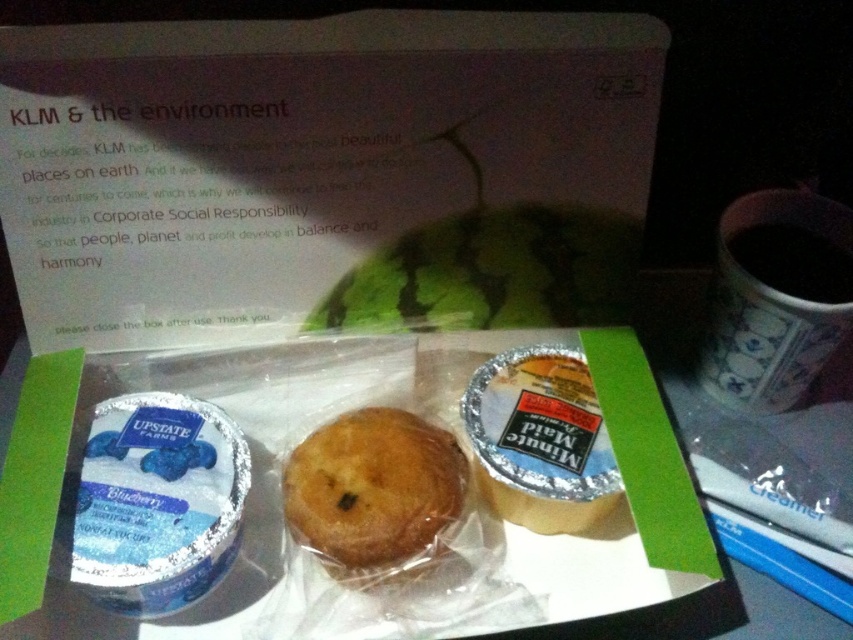
Based on the photo, you are a passenger on a KLM flight and want to reach the point at coordinates point (825, 323) on the meal tray. If you can extend your hand up to 1 meter, can you reach it?

The point at coordinates point (825, 323) is 1.01 meters away from the camera, so you cannot reach it with a hand extension of up to 1 meter.